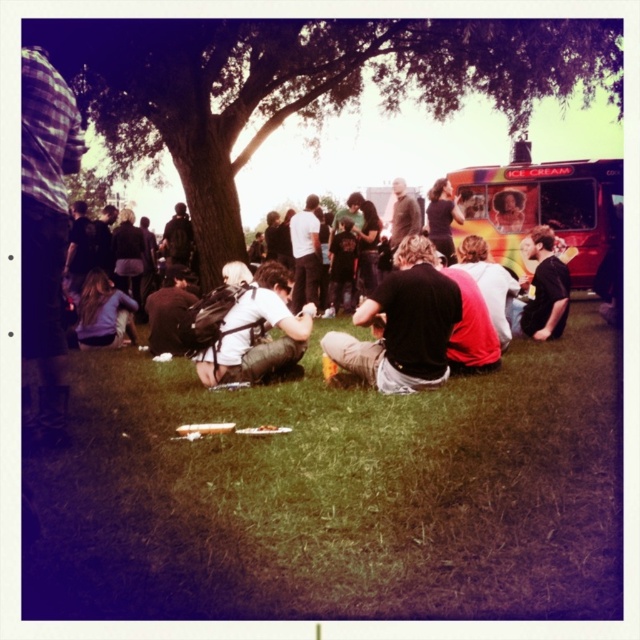
Question: Which point is farther from the camera taking this photo?

Choices:
 (A) (449, 232)
 (B) (282, 314)

Answer: (A)

Question: Can you confirm if white matte shirt at center is positioned above dark gray sweater at center?

Choices:
 (A) yes
 (B) no

Answer: (B)

Question: Which point is farther to the camera?

Choices:
 (A) rainbow painted ice cream truck at right
 (B) green leafy tree at center
 (C) dark brown leather jacket at lower left
 (D) dark gray backpack at center

Answer: (A)

Question: Is rainbow painted ice cream truck at right bigger than white matte shirt at center?

Choices:
 (A) yes
 (B) no

Answer: (A)

Question: Is green leafy tree at center positioned at the back of light brown hair at lower left?

Choices:
 (A) no
 (B) yes

Answer: (A)

Question: Which point is closer to the camera?

Choices:
 (A) (465, 257)
 (B) (406, 193)

Answer: (A)